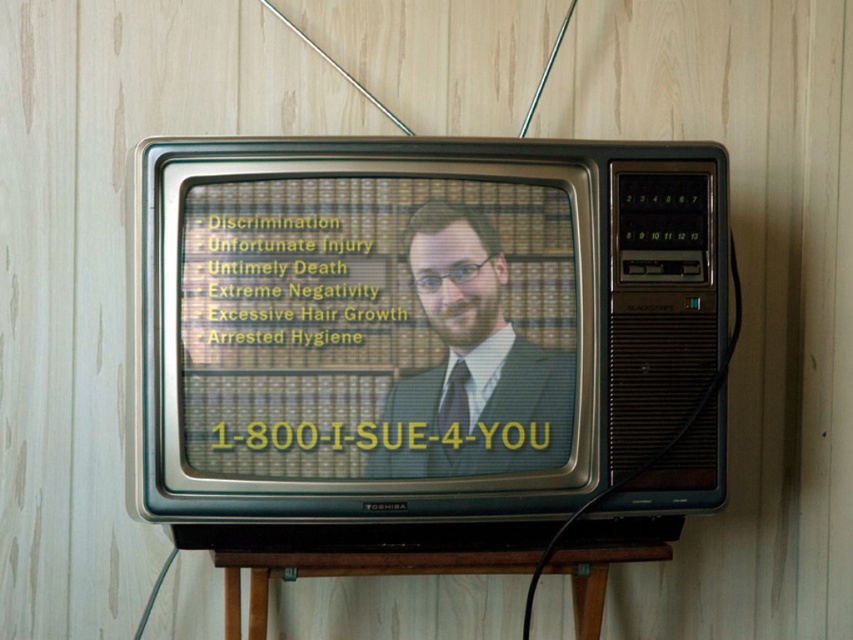
You are a customer service representative who needs to read the yellow text on crt screen at center and the matte black suit at center. Which object is wider?

The yellow text on crt screen at center is wider than the matte black suit at center.

You are a customer service representative who needs to read the yellow text on crt screen at center and the matte black suit at center. Which object is bigger?

The yellow text on crt screen at center is larger in size than the matte black suit at center.

You are a customer service representative who needs to reach the phone number displayed on the yellow text on crt screen at center while standing in front of the matte black suit at center. Can you comfortably reach both the phone number and the suit at the same time if your arms can extend 1.5 inches?

The yellow text on crt screen at center and the matte black suit at center are 1.39 inches apart from each other. Since your arms can extend 1.5 inches, you can comfortably reach both the phone number and the suit at the same time.